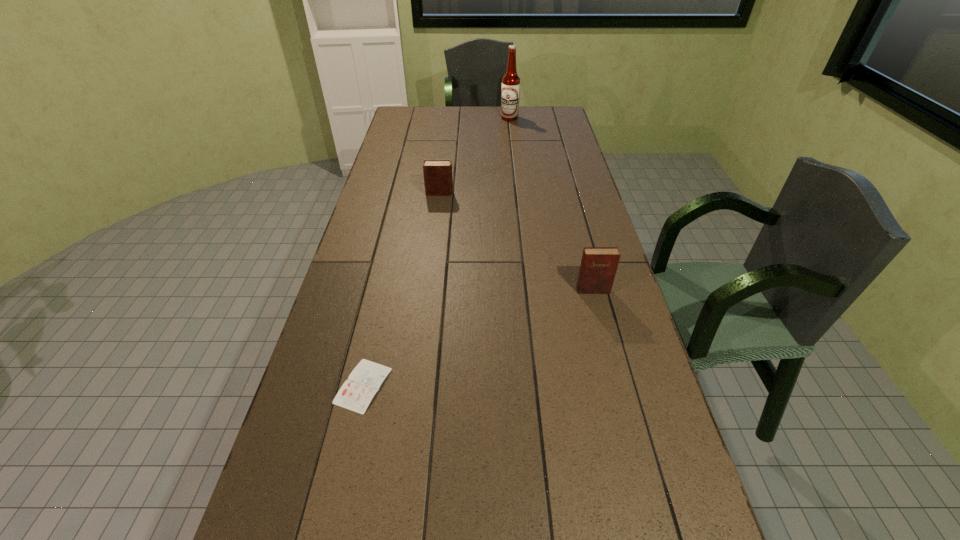
You are a GUI agent. You are given a task and a screenshot of the screen. Output one action in this format:
    pyautogui.click(x=<x>, y=<y>)
    Task: Click on the free region located 0.390m on the spine side of the second farthest object
    
    Given the screenshot: What is the action you would take?
    pyautogui.click(x=555, y=193)

Find the location of a particular element. vacant space situated 0.280m on the right of the leftmost object is located at coordinates click(x=504, y=386).

Find the location of a particular element. Image resolution: width=960 pixels, height=540 pixels. object positioned at the far edge is located at coordinates (510, 93).

Find the location of a particular element. object present at the left edge is located at coordinates (356, 393).

Locate an element on the screen. object situated at the right edge is located at coordinates (598, 267).

This screenshot has height=540, width=960. In the image, there is a desktop. In order to click on free region at the far edge in this screenshot , I will do click(499, 124).

The height and width of the screenshot is (540, 960). In order to click on free location at the left edge in this screenshot , I will do coord(388,241).

In the image, there is a desktop. At what (x,y) coordinates should I click in order to perform the action: click on free space at the right edge. Please return your answer as a coordinate pair (x, y). Image resolution: width=960 pixels, height=540 pixels. Looking at the image, I should click on (687, 504).

Identify the location of free location at the far left corner of the desktop. (408, 112).

This screenshot has width=960, height=540. What are the coordinates of `free space between the farthest diary and the rightmost diary` in the screenshot? It's located at (516, 241).